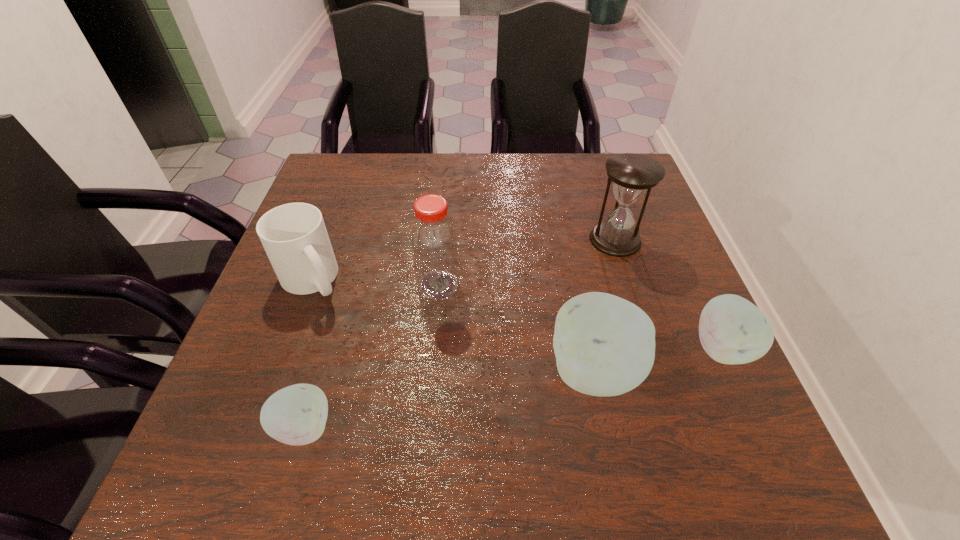
Where is `the shortest object`? Image resolution: width=960 pixels, height=540 pixels. the shortest object is located at coordinates (296, 415).

At what (x,y) coordinates should I click in order to perform the action: click on the shortest apple. Please return your answer as a coordinate pair (x, y). This screenshot has width=960, height=540. Looking at the image, I should click on (296, 415).

Where is `the tallest apple`? the tallest apple is located at coordinates pos(604,345).

Where is `the rightmost object`? The height and width of the screenshot is (540, 960). the rightmost object is located at coordinates (732, 330).

Identify the location of the rightmost apple. The height and width of the screenshot is (540, 960). (732, 330).

Locate an element on the screen. Image resolution: width=960 pixels, height=540 pixels. mug is located at coordinates (294, 236).

This screenshot has width=960, height=540. I want to click on hourglass, so click(633, 175).

Where is `bottle`? bottle is located at coordinates (434, 244).

Locate an element on the screen. The height and width of the screenshot is (540, 960). vacant space located 0.120m on the back of the shortest apple is located at coordinates (327, 346).

The image size is (960, 540). Identify the location of vacant region located on the left of the tallest apple. (438, 372).